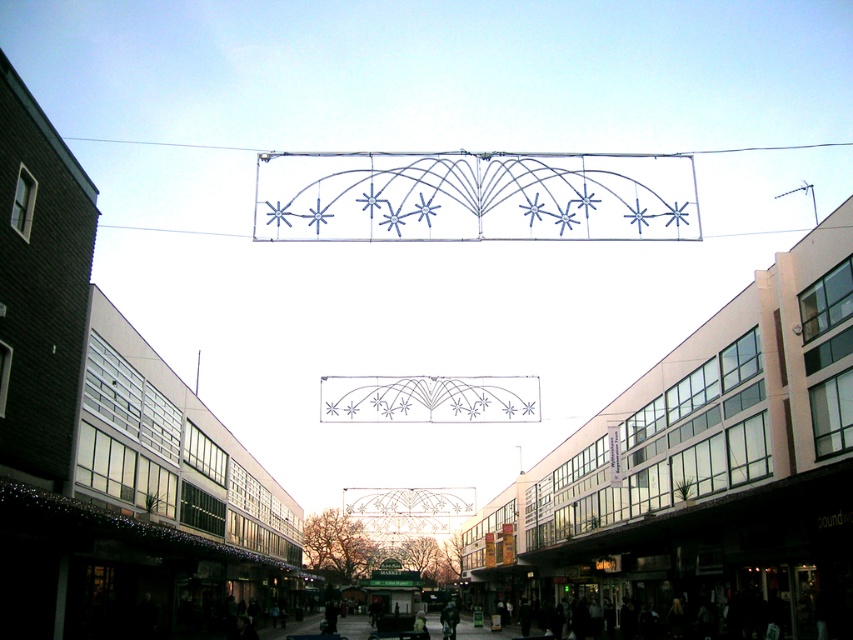
You are a delivery drone flying above the street scene. You need to deliver a package to the metallic glass building at center. There is a metallic wireframe at upper center above it. Will the wireframe block your path to the building?

The metallic glass building at center is below the metallic wireframe at upper center, so the wireframe is directly above the building. The drone will have to navigate around or under the wireframe to reach the building.

You are a photographer planning to take a photo of the metallic glass building at center and the metallic wireframe at upper center. Which object should you focus on first if you want to capture both in a single frame without moving the camera?

You should focus on the metallic glass building at center first because it is larger than the metallic wireframe at upper center, making it the primary subject for the frame.

You are a drone operator who needs to fly a drone through the space between the metallic glass building at center and the metallic wireframe at upper center. Given that the drone is 2 meters tall, can it safely pass through without hitting either structure?

The metallic glass building at center is taller than the metallic wireframe at upper center. Since the drone is 2 meters tall, it can safely pass through the space between them as long as there is sufficient vertical clearance between the two structures. However, the exact height difference isn